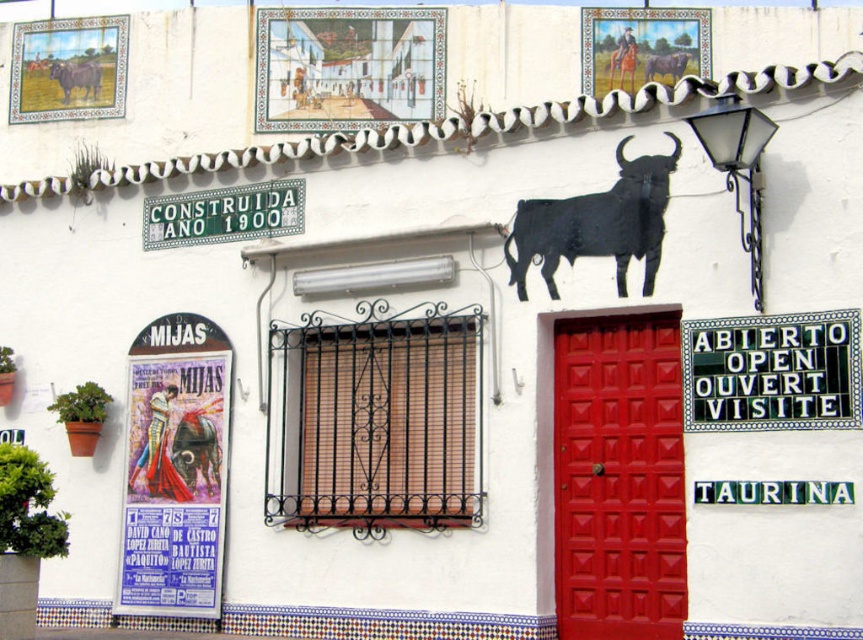
You are standing in front of the building and want to touch both points. Which point should you reach for first, point (255,195) or point (742,236)?

You should reach for point (255,195) first because it is closer to you than point (742,236).

You are standing in front of the building and want to place a 1.5 meter wide banner between the black tile sign at upper right and the matte black bull at upper left. Will there be enough space for the banner?

The distance between the black tile sign at upper right and the matte black bull at upper left is 45.19 meters, so yes, the banner can be placed between them as there is sufficient space.

Looking at this image, you are an architect designing a new building facade and want to ensure proper lighting. Given the black metal streetlamp at upper right and the brown leather horse at upper center, which object should you place a light sensor to detect if the taller object is casting a shadow?

The black metal streetlamp at upper right is taller than the brown leather horse at upper center, so you should place the light sensor to detect shadows cast by the black metal streetlamp at upper right.